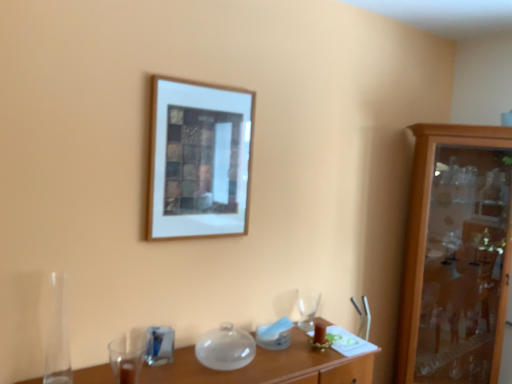
Locate an element on the screen. The height and width of the screenshot is (384, 512). empty space that is to the right of transparent glass vase at lower left is located at coordinates (102, 374).